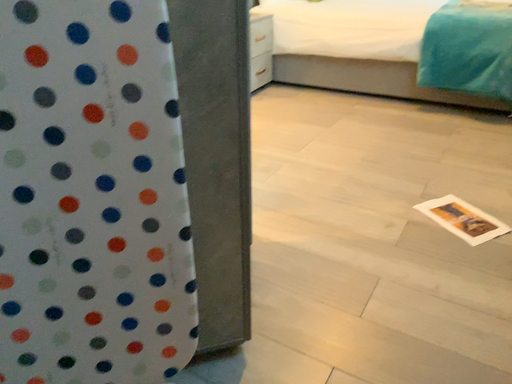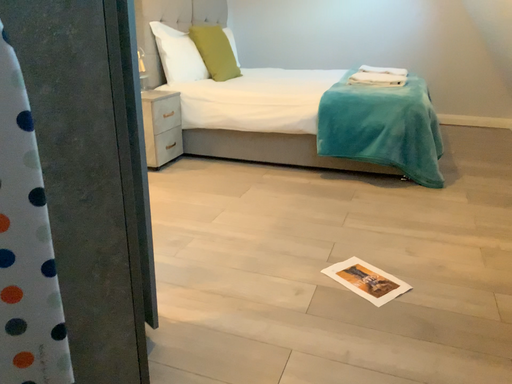
Question: How did the camera likely rotate when shooting the video?

Choices:
 (A) rotated upward
 (B) rotated downward

Answer: (A)